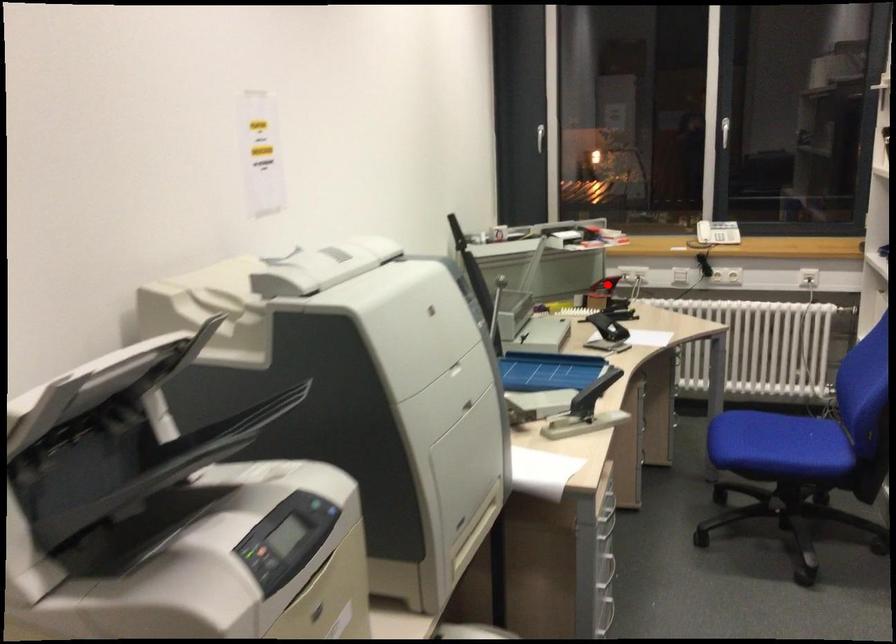
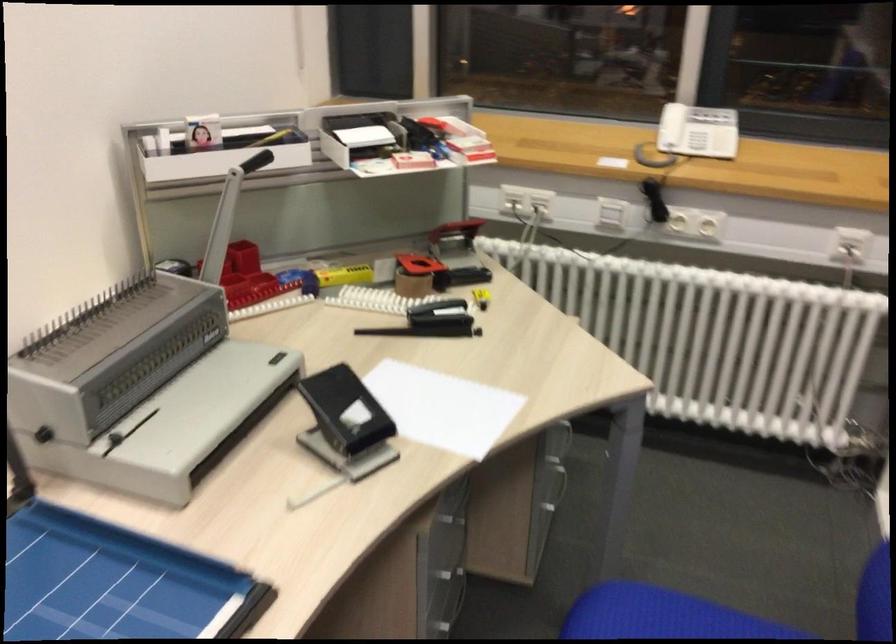
Locate, in the second image, the point that corresponds to the highlighted location in the first image.

(454, 236)